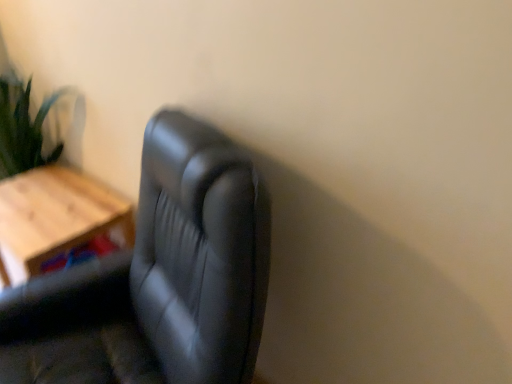
This screenshot has width=512, height=384. I want to click on free space above wooden table at left (from a real-world perspective), so tap(46, 198).